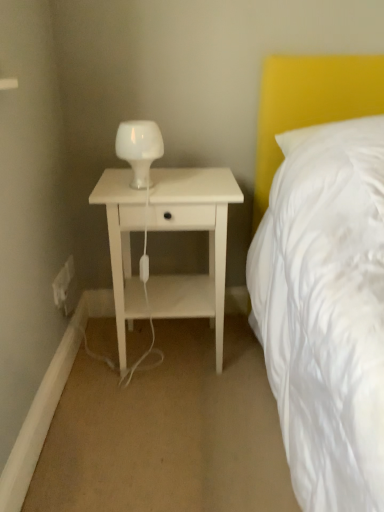
Question: Is white matte nightstand at center to the left of white glass lamp at center from the viewer's perspective?

Choices:
 (A) no
 (B) yes

Answer: (A)

Question: Can you confirm if white matte nightstand at center is taller than white glass lamp at center?

Choices:
 (A) no
 (B) yes

Answer: (B)

Question: Considering the relative sizes of white matte nightstand at center and white glass lamp at center in the image provided, is white matte nightstand at center shorter than white glass lamp at center?

Choices:
 (A) yes
 (B) no

Answer: (B)

Question: Is white matte nightstand at center positioned behind white glass lamp at center?

Choices:
 (A) yes
 (B) no

Answer: (B)

Question: From the image's perspective, is white matte nightstand at center located beneath white glass lamp at center?

Choices:
 (A) yes
 (B) no

Answer: (A)

Question: Could you tell me if white matte nightstand at center is turned towards white glass lamp at center?

Choices:
 (A) yes
 (B) no

Answer: (B)

Question: From a real-world perspective, is white plastic electric outlet at lower left, which appears as the first electric outlet when viewed from the front, over white glass lamp at center?

Choices:
 (A) no
 (B) yes

Answer: (A)

Question: Does white plastic electric outlet at lower left, arranged as the second electric outlet when viewed from the back, have a lesser height compared to white glass lamp at center?

Choices:
 (A) no
 (B) yes

Answer: (B)

Question: Could you tell me if white plastic electric outlet at lower left, arranged as the second electric outlet when viewed from the back, is turned towards white glass lamp at center?

Choices:
 (A) yes
 (B) no

Answer: (B)

Question: From the image's perspective, is white plastic electric outlet at lower left, arranged as the second electric outlet when viewed from the back, located above white glass lamp at center?

Choices:
 (A) yes
 (B) no

Answer: (B)

Question: From a real-world perspective, is white plastic electric outlet at lower left, which appears as the first electric outlet when viewed from the front, under white glass lamp at center?

Choices:
 (A) yes
 (B) no

Answer: (A)

Question: Considering the relative positions of white plastic electric outlet at lower left, which appears as the first electric outlet when viewed from the front, and white glass lamp at center in the image provided, is white plastic electric outlet at lower left, which appears as the first electric outlet when viewed from the front, to the right of white glass lamp at center from the viewer's perspective?

Choices:
 (A) yes
 (B) no

Answer: (B)

Question: Can you confirm if white matte nightstand at center is wider than white plastic electric outlet at lower left, arranged as the 2th electric outlet when viewed from the front?

Choices:
 (A) no
 (B) yes

Answer: (B)